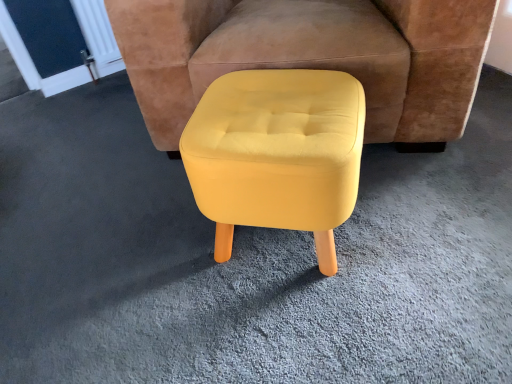
This screenshot has width=512, height=384. Find the location of `spots to the right of yellow fabric stool at center`. spots to the right of yellow fabric stool at center is located at coordinates (430, 234).